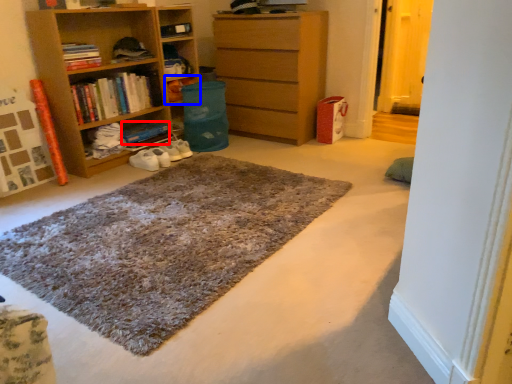
Question: Which point is further to the camera, book (highlighted by a red box) or shelf (highlighted by a blue box)?

Choices:
 (A) book
 (B) shelf

Answer: (B)